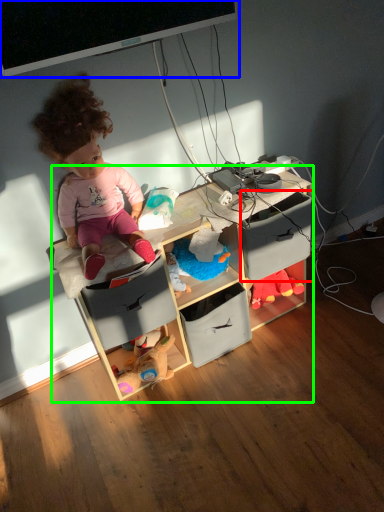
Question: Estimate the real-world distances between objects in this image. Which object is farther from drawer (highlighted by a red box), computer monitor (highlighted by a blue box) or shelf (highlighted by a green box)?

Choices:
 (A) computer monitor
 (B) shelf

Answer: (A)